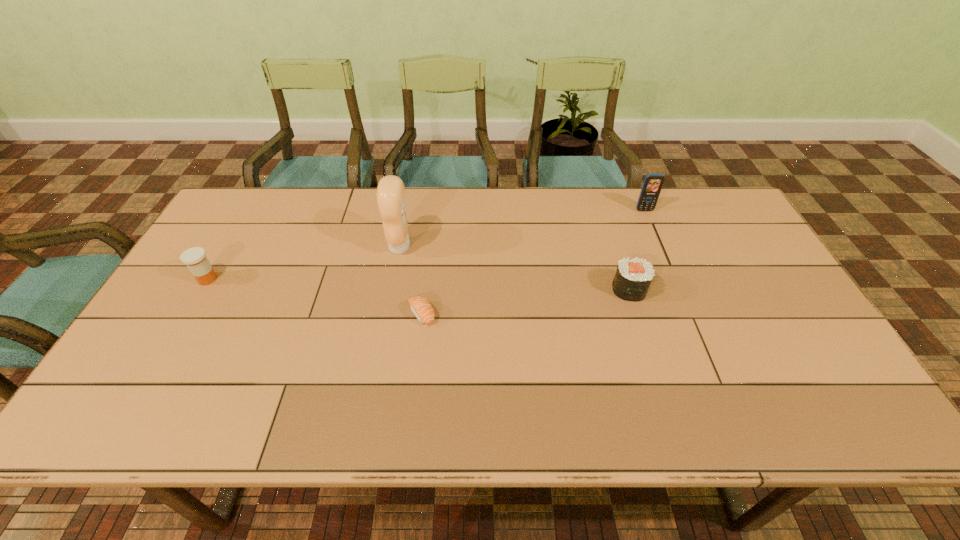
Locate an element on the screen. This screenshot has width=960, height=540. vacant region located on the screen of the farthest object is located at coordinates (660, 249).

Locate an element on the screen. This screenshot has width=960, height=540. vacant area situated 0.280m on the label of the leftmost object is located at coordinates (318, 279).

The image size is (960, 540). Identify the location of free space located on the front of the fourth object from left to right. (673, 426).

The height and width of the screenshot is (540, 960). Identify the location of free space located on the back of the third object from right to left. (433, 219).

Where is `object that is positioned at the far edge`? Image resolution: width=960 pixels, height=540 pixels. object that is positioned at the far edge is located at coordinates (652, 185).

You are a GUI agent. You are given a task and a screenshot of the screen. Output one action in this format:
    pyautogui.click(x=<x>, y=<y>)
    Task: Click on the object present at the left edge
    The width and height of the screenshot is (960, 540).
    Given the screenshot: What is the action you would take?
    coord(195,258)

At what (x,y) coordinates should I click in order to perform the action: click on free space at the far edge. Please return your answer as a coordinate pair (x, y). This screenshot has width=960, height=540. Looking at the image, I should click on [x=381, y=221].

In order to click on vacant region at the near edge of the desktop in this screenshot , I will do pos(576,416).

Where is `vacant point at the right edge`? Image resolution: width=960 pixels, height=540 pixels. vacant point at the right edge is located at coordinates (727, 258).

This screenshot has width=960, height=540. I want to click on free spot at the near left corner of the desktop, so click(148, 415).